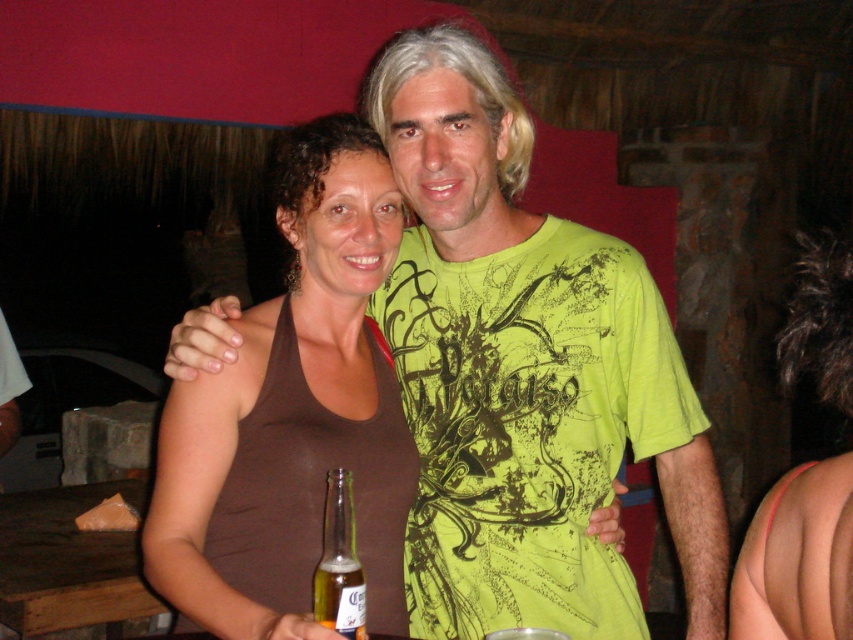
Does point (616, 332) come farther from viewer compared to point (318, 588)?

Yes, point (616, 332) is behind point (318, 588).

Based on the photo, does green printed t-shirt at center appear under gold glass bottle at lower center?

No.

Is point (393, 173) in front of point (323, 561)?

No, it is not.

The width and height of the screenshot is (853, 640). What are the coordinates of `green printed t-shirt at center` in the screenshot? It's located at (524, 371).

Is translucent glass bottle at lower center positioned behind gold glass bottle at lower center?

That is False.

Which is more to the left, translucent glass bottle at lower center or gold glass bottle at lower center?

gold glass bottle at lower center is more to the left.

Find the location of a particular element. The image size is (853, 640). translucent glass bottle at lower center is located at coordinates (339, 563).

Does green printed t-shirt at center appear under brown fabric tank top at center?

No, green printed t-shirt at center is not below brown fabric tank top at center.

Does point (503, 310) come behind point (173, 566)?

Yes, it is behind point (173, 566).

Is point (595, 316) positioned after point (175, 586)?

Yes, point (595, 316) is behind point (175, 586).

Locate an element on the screen. green printed t-shirt at center is located at coordinates (524, 371).